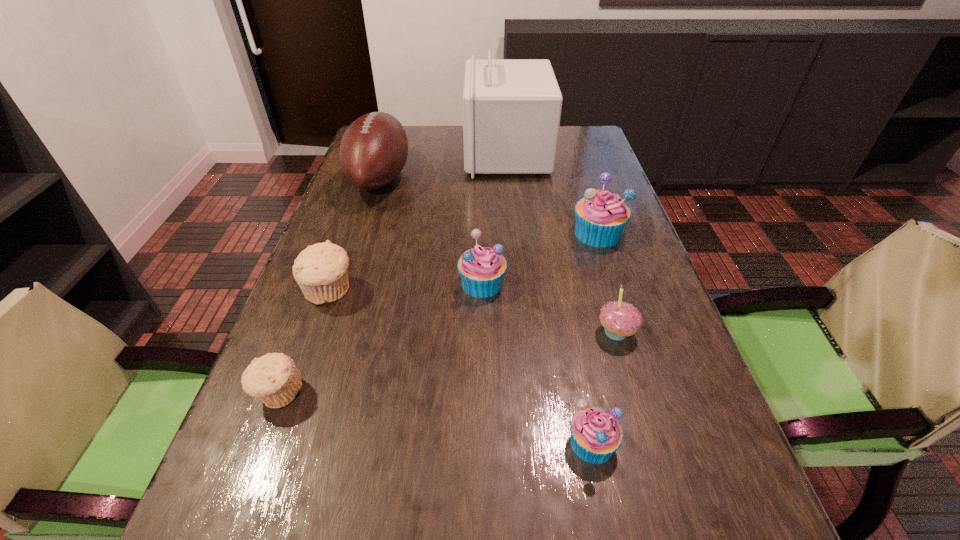
You are a GUI agent. You are given a task and a screenshot of the screen. Output one action in this format:
    pyautogui.click(x=<x>, y=<y>)
    Task: Click on the vacant region located 0.070m on the left of the second biggest blue muffin
    
    Given the screenshot: What is the action you would take?
    [427, 283]

Find the location of a particular element. This screenshot has width=960, height=540. vacant space situated 0.180m on the back of the bigger beige muffin is located at coordinates (351, 227).

Locate an element on the screen. vacant position located on the back of the cupcake is located at coordinates (596, 261).

The width and height of the screenshot is (960, 540). I want to click on vacant area situated 0.120m on the left of the second muffin from right to left, so click(x=494, y=443).

At what (x,y) coordinates should I click in order to perform the action: click on free spot located 0.170m on the right of the fourth farthest muffin. Please return your answer as a coordinate pair (x, y). Looking at the image, I should click on (397, 393).

Locate an element on the screen. the first-aid kit present at the far edge is located at coordinates (512, 108).

Find the location of a particular element. football (American) located in the far edge section of the desktop is located at coordinates (374, 148).

Identify the location of football (American) that is at the left edge. This screenshot has height=540, width=960. (374, 148).

You are a GUI agent. You are given a task and a screenshot of the screen. Output one action in this format:
    pyautogui.click(x=<x>, y=<y>)
    Task: Click on the muffin located in the right edge section of the desktop
    The width and height of the screenshot is (960, 540).
    Given the screenshot: What is the action you would take?
    pyautogui.click(x=601, y=216)

This screenshot has width=960, height=540. Find the location of `cupcake that is at the right edge`. cupcake that is at the right edge is located at coordinates (620, 319).